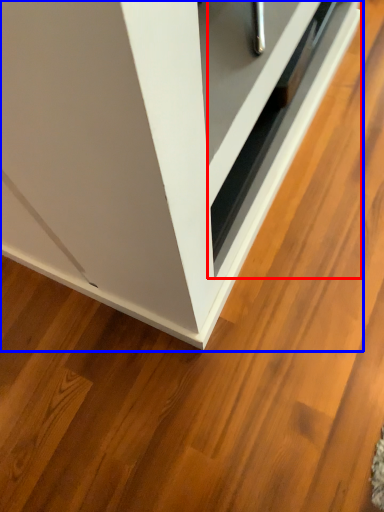
Question: Among these objects, which one is farthest to the camera, drawer (highlighted by a red box) or cabinetry (highlighted by a blue box)?

Choices:
 (A) drawer
 (B) cabinetry

Answer: (A)